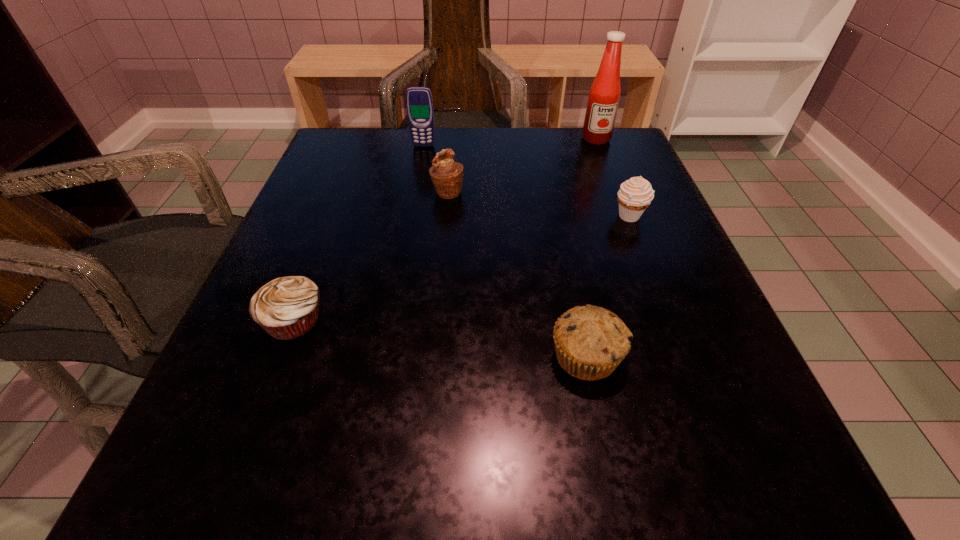
This screenshot has width=960, height=540. What are the coordinates of `vacant region between the condiment and the rightmost muffin` in the screenshot? It's located at (612, 178).

At what (x,y) coordinates should I click in order to perform the action: click on free space that is in between the condiment and the third nearest object. Please return your answer as a coordinate pair (x, y). Looking at the image, I should click on (612, 178).

The image size is (960, 540). What are the coordinates of `vacant area that lies between the condiment and the leftmost object` in the screenshot? It's located at (x=444, y=230).

Identify the location of free point between the tallest object and the second tallest object. (510, 142).

At what (x,y) coordinates should I click in order to perform the action: click on blank region between the third nearest object and the third muffin from left to right. Please return your answer as a coordinate pair (x, y). This screenshot has width=960, height=540. Looking at the image, I should click on (608, 287).

At what (x,y) coordinates should I click in order to perform the action: click on vacant area that lies between the tallest object and the third object from left to right. Please return your answer as a coordinate pair (x, y). Looking at the image, I should click on (522, 165).

At what (x,y) coordinates should I click in order to perform the action: click on free spot between the leftmost muffin and the third farthest object. Please return your answer as a coordinate pair (x, y). The width and height of the screenshot is (960, 540). Looking at the image, I should click on (371, 256).

Locate which object ranks third in proximity to the condiment. Please provide its 2D coordinates. Your answer should be formatted as a tuple, i.e. [(x, y)], where the tuple contains the x and y coordinates of a point satisfying the conditions above.

[(419, 103)]

The width and height of the screenshot is (960, 540). In order to click on the closest object relative to the tallest object in this screenshot , I will do `click(635, 195)`.

At what (x,y) coordinates should I click in order to perform the action: click on muffin that is the third closest to the third nearest object. Please return your answer as a coordinate pair (x, y). The height and width of the screenshot is (540, 960). Looking at the image, I should click on tap(286, 308).